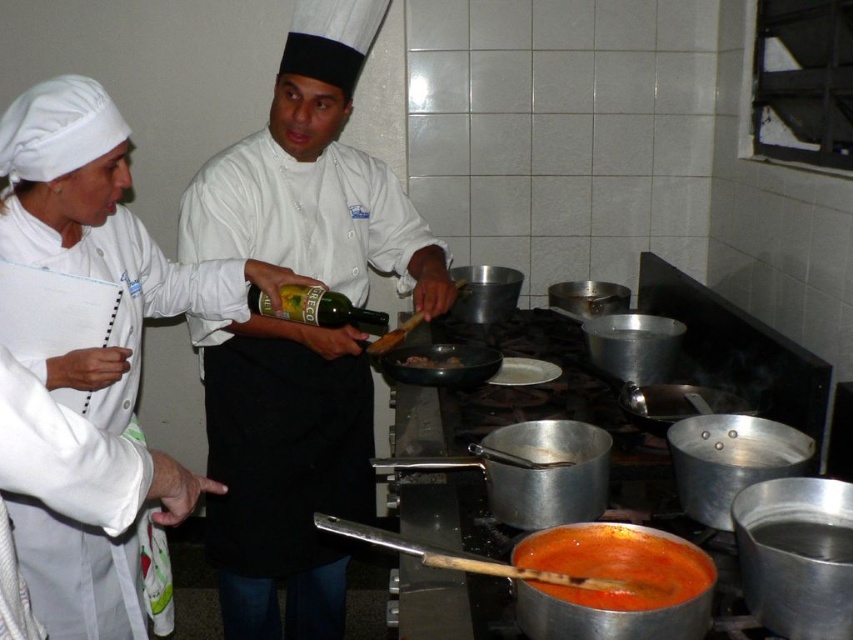
Between white glossy chef hat at center and green glass bottle at center, which one has less height?

With less height is green glass bottle at center.

Does white glossy chef hat at center have a larger size compared to green glass bottle at center?

Indeed, white glossy chef hat at center has a larger size compared to green glass bottle at center.

Identify the location of white glossy chef hat at center. The height and width of the screenshot is (640, 853). (283, 468).

Between white glossy chef hat at center and white glossy chef coat at left, which one has less height?

white glossy chef coat at left is shorter.

Between point (373, 445) and point (78, 128), which one is positioned in front?

Point (78, 128) is more forward.

You are a GUI agent. You are given a task and a screenshot of the screen. Output one action in this format:
    pyautogui.click(x=<x>, y=<y>)
    Task: Click on the white glossy chef hat at center
    The image size is (853, 640).
    Given the screenshot: What is the action you would take?
    pyautogui.click(x=283, y=468)

From the picture: Does white glossy chef coat at left appear on the left side of tomato sauce at lower center?

Correct, you'll find white glossy chef coat at left to the left of tomato sauce at lower center.

Is point (108, 308) closer to camera compared to point (650, 593)?

No, (108, 308) is further to viewer.

This screenshot has height=640, width=853. In order to click on white glossy chef coat at left in this screenshot , I will do `click(91, 253)`.